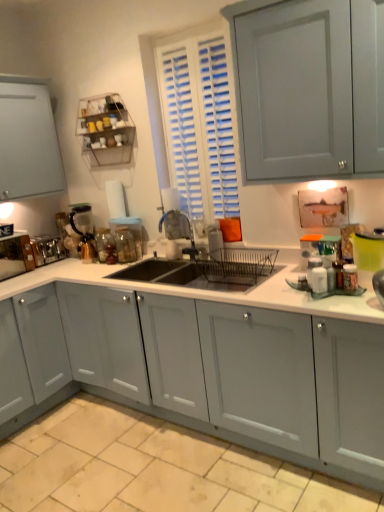
This screenshot has height=512, width=384. In order to click on free space in front of clear glass jar at sink, the 1th appliance when ordered from right to left in this screenshot , I will do `click(132, 273)`.